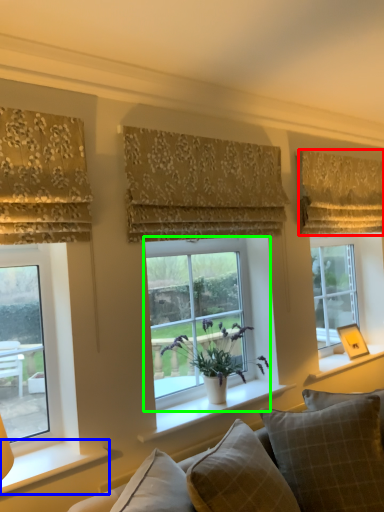
Question: Considering the real-world distances, which object is farthest from curtain (highlighted by a red box)? window sill (highlighted by a blue box) or window (highlighted by a green box)?

Choices:
 (A) window sill
 (B) window

Answer: (A)